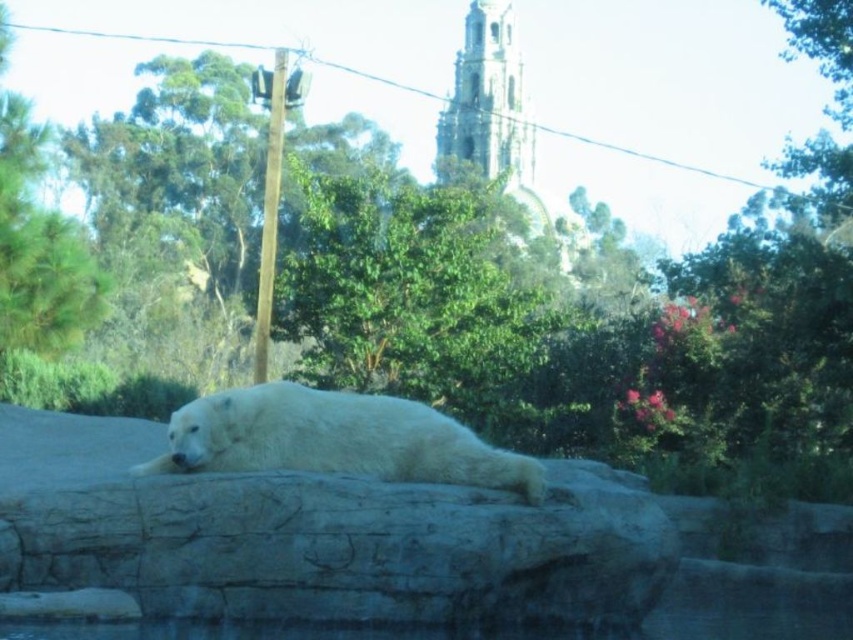
Question: Which of the following is the farthest from the observer?

Choices:
 (A) white smooth rock at center
 (B) white fur bear at center

Answer: (B)

Question: Which point is farther to the camera?

Choices:
 (A) (250, 401)
 (B) (544, 545)

Answer: (A)

Question: Does white smooth rock at center have a larger size compared to white fur bear at center?

Choices:
 (A) yes
 (B) no

Answer: (A)

Question: Does white smooth rock at center appear under white fur bear at center?

Choices:
 (A) yes
 (B) no

Answer: (A)

Question: Does white smooth rock at center come in front of white fur bear at center?

Choices:
 (A) yes
 (B) no

Answer: (A)

Question: Among these objects, which one is nearest to the camera?

Choices:
 (A) white smooth rock at center
 (B) white fur bear at center

Answer: (A)